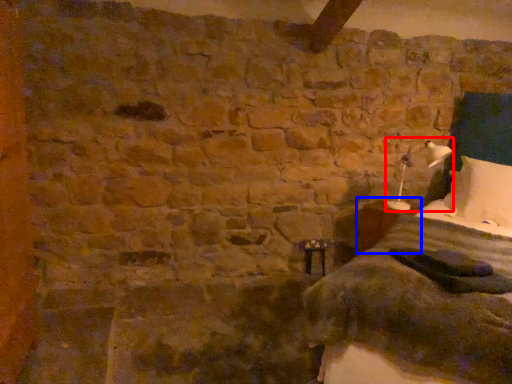
Question: Which object appears farthest to the camera in this image, bedside lamp (highlighted by a red box) or table (highlighted by a blue box)?

Choices:
 (A) bedside lamp
 (B) table

Answer: (B)